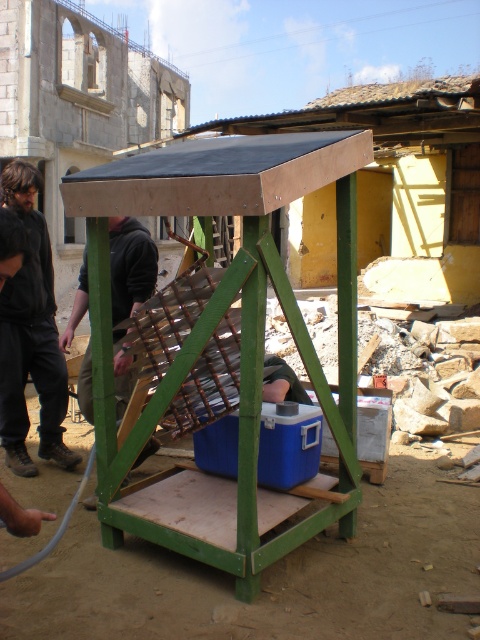
Which is below, dark brown leather jacket at left or dark gray hoodie at center?

dark gray hoodie at center is below.

Between point (26, 300) and point (152, 280), which one is positioned behind?

The point (26, 300) is behind.

The width and height of the screenshot is (480, 640). I want to click on dark brown leather jacket at left, so click(31, 337).

Which of these two, wooden crate at center or dark brown leather jacket at left, stands shorter?

Standing shorter between the two is dark brown leather jacket at left.

Who is more distant from viewer, (204, 314) or (40, 236)?

The point (40, 236) is more distant.

Identify the location of wooden crate at center. The image size is (480, 640). (240, 339).

Who is shorter, wooden crate at center or dark gray hoodie at center?

dark gray hoodie at center

Can you confirm if wooden crate at center is smaller than dark gray hoodie at center?

No.

Does point (260, 403) lie in front of point (121, 294)?

Yes, point (260, 403) is in front of point (121, 294).

The image size is (480, 640). In order to click on wooden crate at center in this screenshot , I will do `click(240, 339)`.